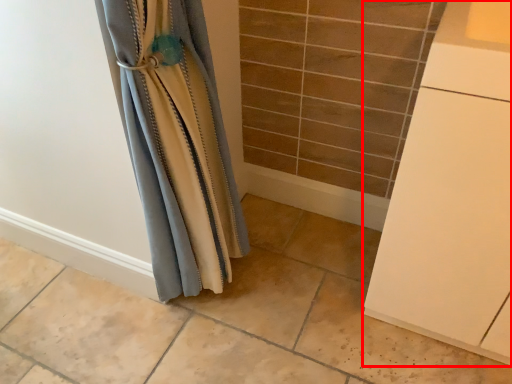
Question: Observing the image, what is the correct spatial positioning of cabinetry (annotated by the red box) in reference to curtain?

Choices:
 (A) right
 (B) left

Answer: (A)